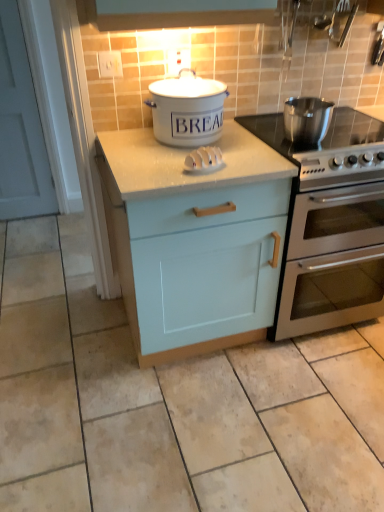
Locate an element on the screen. This screenshot has width=384, height=512. free space on the front side of white ceramic bread bin at center, acting as the 1th kitchen appliance starting from the left is located at coordinates (188, 162).